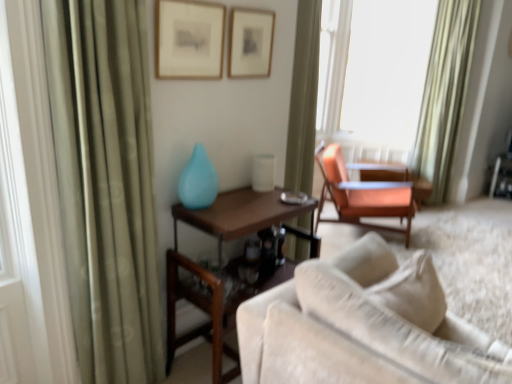
Identify the location of vacant space in between matte glass vase at center and white glossy table lamp at center. (240, 195).